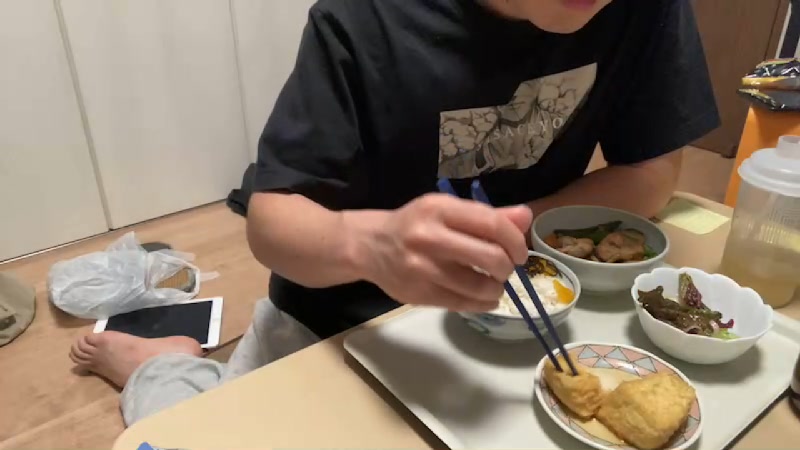
Image resolution: width=800 pixels, height=450 pixels. What are the coordinates of `tray` in the screenshot? It's located at (288, 409).